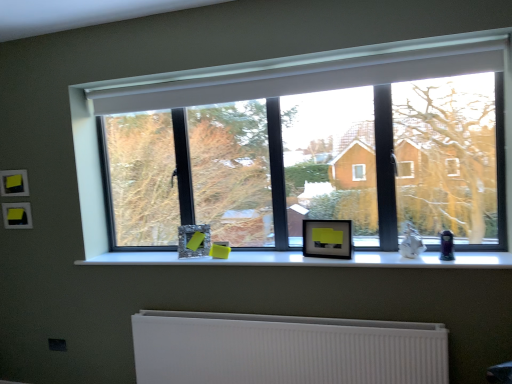
This screenshot has height=384, width=512. Identify the location of free space to the left of black matte picture frame at center, which is the 1th picture frame in front-to-back order. (300, 259).